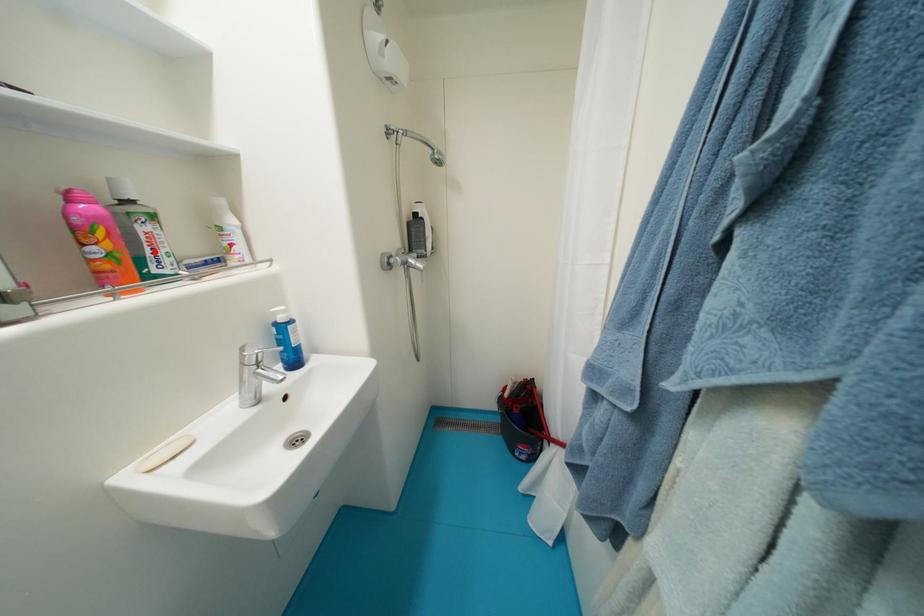
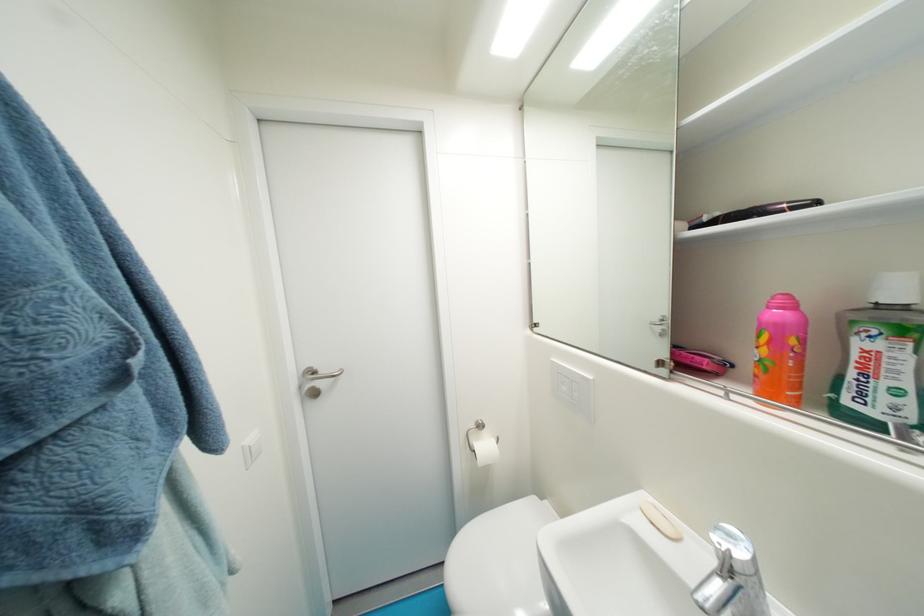
Locate, in the second image, the point that corresponds to the highlighted location in the first image.

(858, 376)